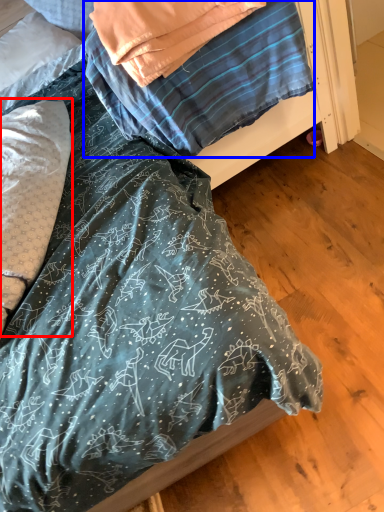
Question: Which object appears farthest to the camera in this image, pillow (highlighted by a red box) or blanket (highlighted by a blue box)?

Choices:
 (A) pillow
 (B) blanket

Answer: (B)